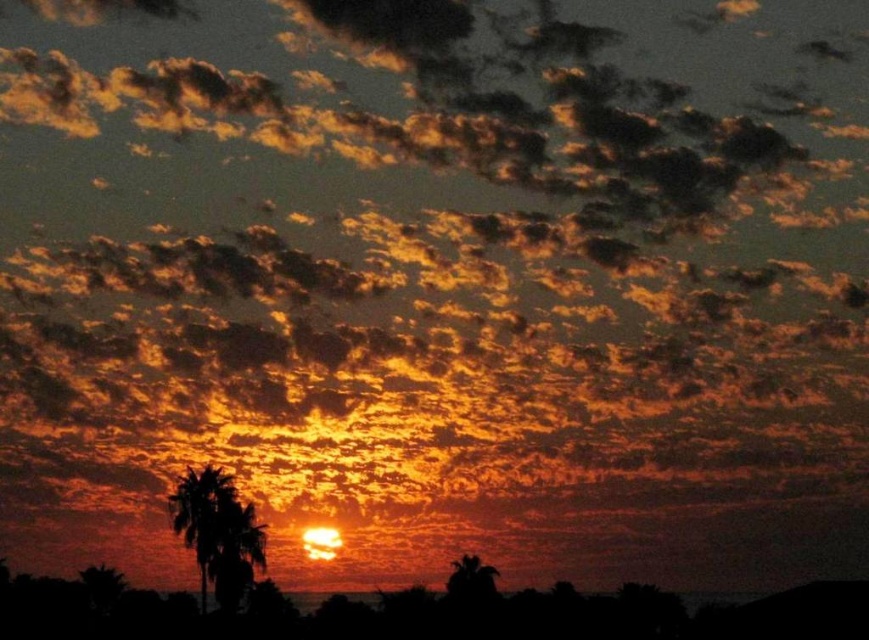
Question: Does silhouette palm tree at left have a larger size compared to silhouette palm tree at lower right?

Choices:
 (A) yes
 (B) no

Answer: (A)

Question: Among these objects, which one is farthest from the camera?

Choices:
 (A) silhouette palm tree at left
 (B) silhouette palm tree at lower right

Answer: (B)

Question: Does silhouette palm tree at left come behind silhouette palm tree at lower right?

Choices:
 (A) no
 (B) yes

Answer: (A)

Question: Which of the following is the farthest from the observer?

Choices:
 (A) silhouette palm tree at lower right
 (B) silhouette palm tree at left

Answer: (A)

Question: Does silhouette palm tree at left lie in front of silhouette palm tree at lower right?

Choices:
 (A) yes
 (B) no

Answer: (A)